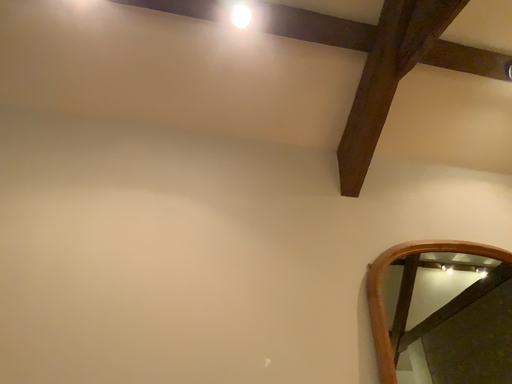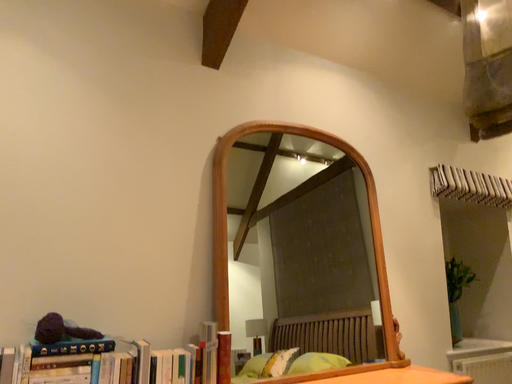
Question: Which way did the camera rotate in the video?

Choices:
 (A) rotated right
 (B) rotated left

Answer: (A)